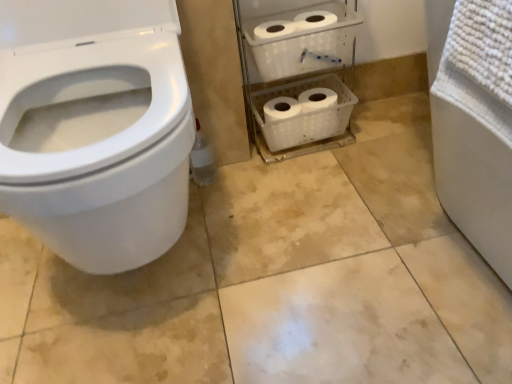
Image resolution: width=512 pixels, height=384 pixels. Find the location of `free location to the right of white glossy toilet at left`. free location to the right of white glossy toilet at left is located at coordinates (320, 250).